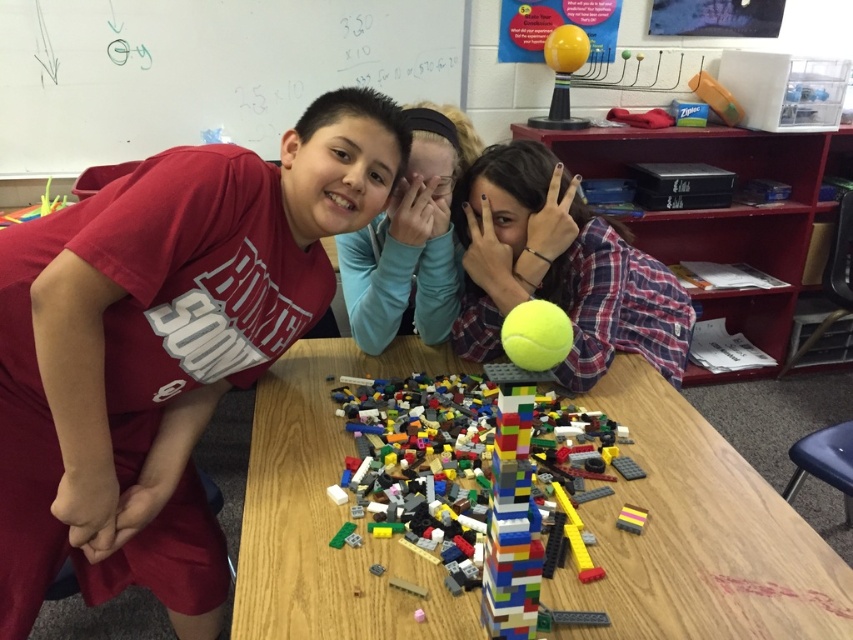
You are a teacher observing the classroom scene. The children are playing with LEGO bricks and a tennis ball. Where is the matte red shirt at left in relation to the multicolored plastic blocks at center?

The matte red shirt at left is to the left of the multicolored plastic blocks at center.

You are a teacher observing the classroom activity. You notice the matte red shirt at left and the yellow matte tennis ball at center. Which object takes up more space in the scene?

The matte red shirt at left has a larger size compared to the yellow matte tennis ball at center, so the matte red shirt at left takes up more space in the scene.